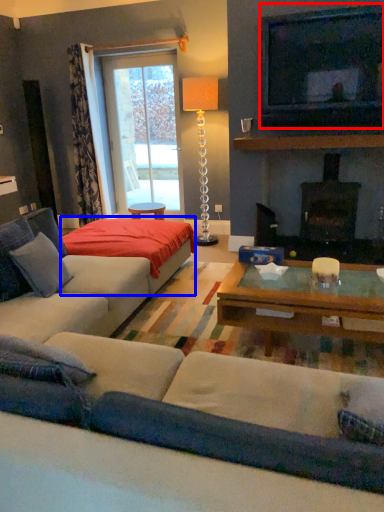
Question: Which of the following is the closest to the observer, television (highlighted by a red box) or plain (highlighted by a blue box)?

Choices:
 (A) television
 (B) plain

Answer: (B)